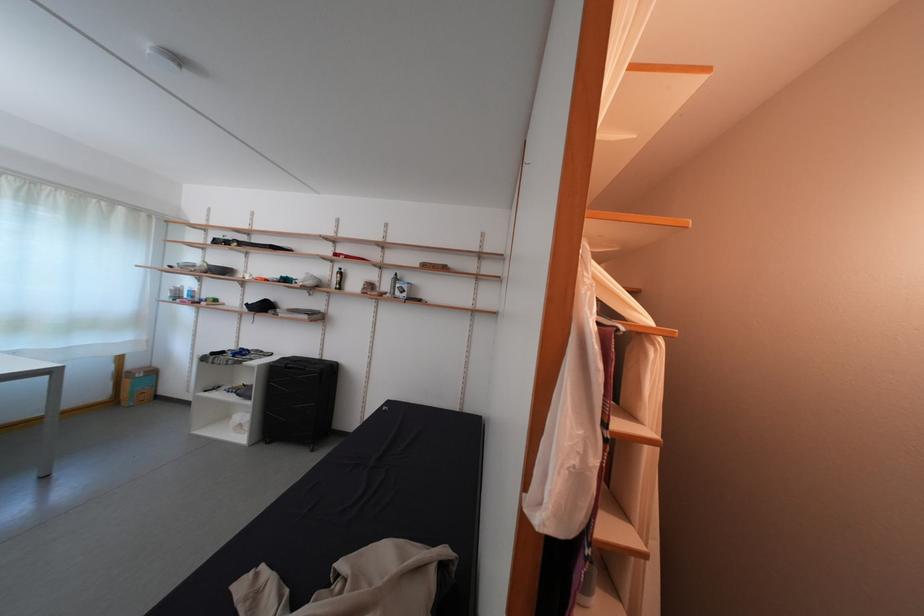
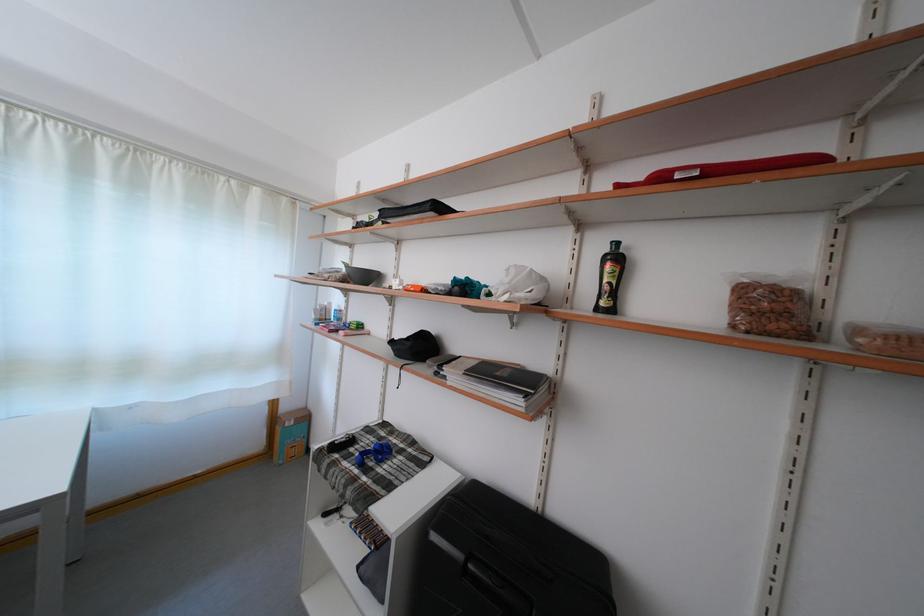
In the second image, find the point that corresponds to (x=314, y=323) in the first image.

(527, 408)